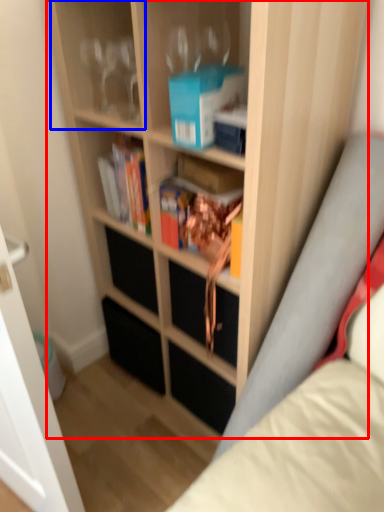
Question: Which point is closer to the camera, bookcase (highlighted by a red box) or shelf (highlighted by a blue box)?

Choices:
 (A) bookcase
 (B) shelf

Answer: (A)